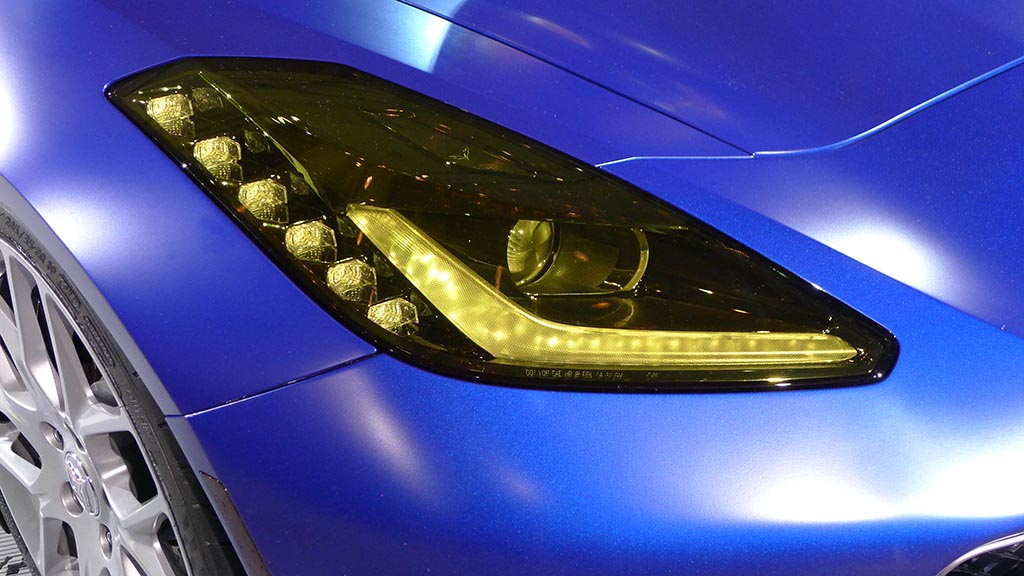
Where is `glass`? The image size is (1024, 576). glass is located at coordinates (404, 168).